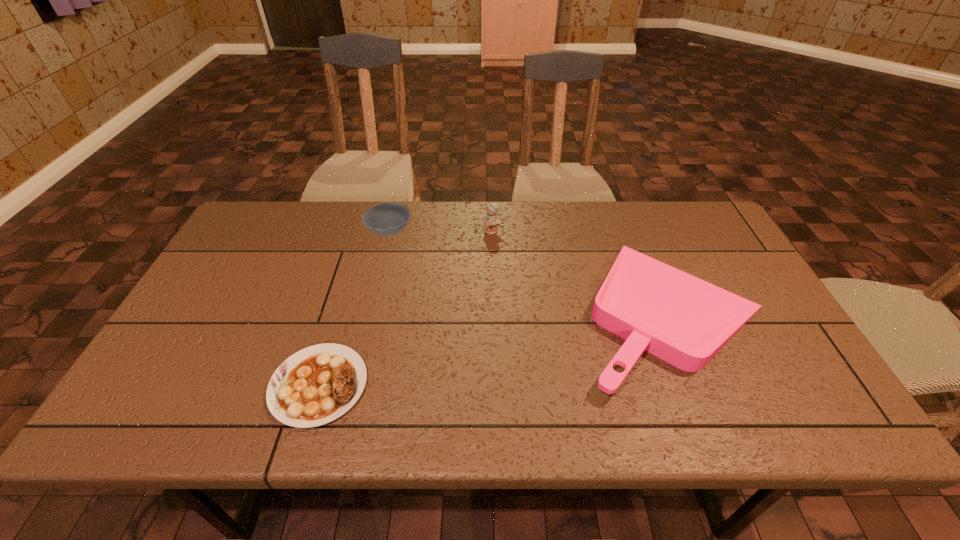
Image resolution: width=960 pixels, height=540 pixels. I want to click on teddy bear, so tap(491, 220).

Find the location of a particular element. This screenshot has width=960, height=540. the second object from right to left is located at coordinates (491, 220).

Find the location of a particular element. This screenshot has width=960, height=540. bowl is located at coordinates (387, 219).

Find the location of `the rightmost object`. the rightmost object is located at coordinates (681, 319).

Locate an element on the screen. the shortest object is located at coordinates (318, 384).

I want to click on free space located on the front-facing side of the tallest object, so click(493, 282).

Find the location of `blank space located on the left of the bowl`. blank space located on the left of the bowl is located at coordinates (254, 232).

In order to click on vacant region located on the handle side of the rightmost object in this screenshot , I will do `click(516, 312)`.

The width and height of the screenshot is (960, 540). I want to click on free spot located on the handle side of the rightmost object, so click(x=486, y=312).

Identify the location of vacant area situated on the handle side of the rightmost object. This screenshot has width=960, height=540. (424, 312).